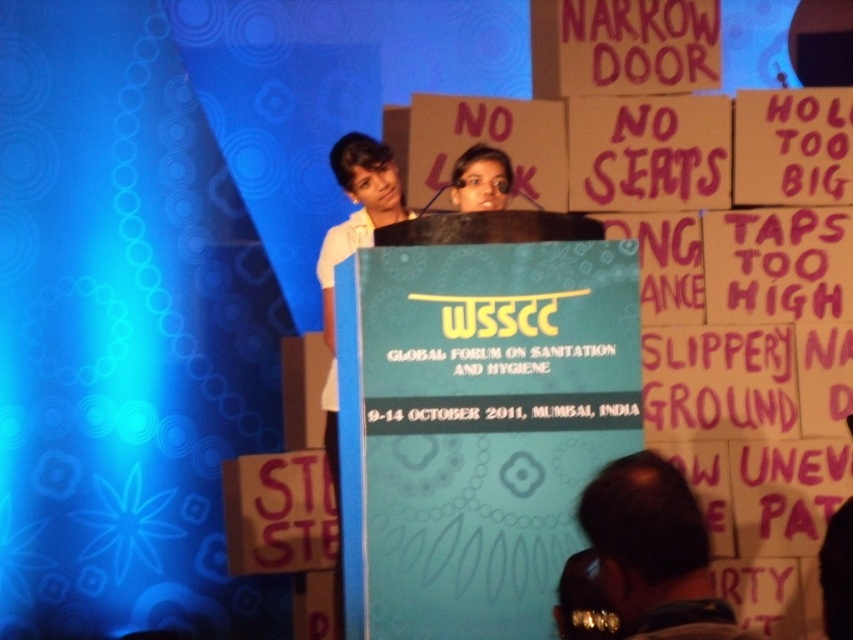
Question: Which point is farther to the camera?

Choices:
 (A) (485, 177)
 (B) (679, 477)

Answer: (A)

Question: Does dark brown leather jacket at lower right have a greater width compared to matte black hair at center?

Choices:
 (A) no
 (B) yes

Answer: (B)

Question: Among these objects, which one is nearest to the camera?

Choices:
 (A) dark brown leather jacket at lower right
 (B) matte black hair at center

Answer: (A)

Question: Which object appears closest to the camera in this image?

Choices:
 (A) matte black hair at center
 (B) dark brown leather jacket at lower right

Answer: (B)

Question: Where is dark brown leather jacket at lower right located in relation to matte black hair at center in the image?

Choices:
 (A) above
 (B) below

Answer: (B)

Question: Can you confirm if dark brown leather jacket at lower right is positioned to the right of matte black hair at center?

Choices:
 (A) yes
 (B) no

Answer: (A)